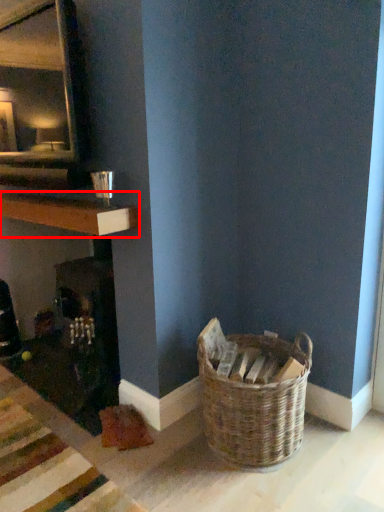
Question: From the image's perspective, what is the correct spatial positioning of shelf (annotated by the red box) in reference to picnic basket?

Choices:
 (A) above
 (B) below

Answer: (A)